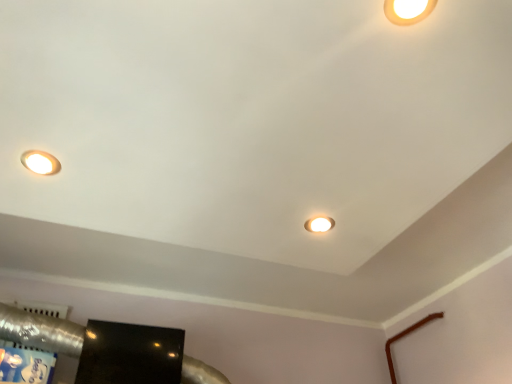
At what (x,y) coordinates should I click in order to perform the action: click on matte white lamp at upper right, which appears as the third lamp when viewed from the back. Please return your answer as a coordinate pair (x, y). The image size is (512, 384). Looking at the image, I should click on (408, 10).

Measure the distance between point (408, 2) and camera.

The distance of point (408, 2) from camera is 27.76 inches.

Where is `matte white lamp at center, which ranks as the second lamp in right-to-left order`? This screenshot has height=384, width=512. matte white lamp at center, which ranks as the second lamp in right-to-left order is located at coordinates (319, 224).

What is the approximate width of glossy black tv at lower left?

It is 15.60 centimeters.

The height and width of the screenshot is (384, 512). In order to click on glossy black tv at lower left in this screenshot , I will do `click(130, 354)`.

The height and width of the screenshot is (384, 512). What are the coordinates of `matte white lamp at upper right, which ranks as the 1th lamp in right-to-left order` in the screenshot? It's located at (408, 10).

Considering the relative sizes of matte white lamp at upper right, arranged as the 1th lamp when viewed from the front, and matte white lamp at upper left, which appears as the third lamp when viewed from the right, in the image provided, is matte white lamp at upper right, arranged as the 1th lamp when viewed from the front, smaller than matte white lamp at upper left, which appears as the third lamp when viewed from the right,?

No.

How many degrees apart are the facing directions of matte white lamp at upper right, which is counted as the 3th lamp, starting from the left, and matte white lamp at upper left, marked as the 2th lamp in a back-to-front arrangement?

The angular difference between matte white lamp at upper right, which is counted as the 3th lamp, starting from the left, and matte white lamp at upper left, marked as the 2th lamp in a back-to-front arrangement, is 180 degrees.

You are a GUI agent. You are given a task and a screenshot of the screen. Output one action in this format:
    pyautogui.click(x=<x>, y=<y>)
    Task: Click on the lamp in front of the matte white lamp at upper left, the first lamp from the left
    The image size is (512, 384).
    Given the screenshot: What is the action you would take?
    (408, 10)

Is matte white lamp at upper left, marked as the 2th lamp in a back-to-front arrangement, located within matte white lamp at upper right, the third lamp when ordered from bottom to top?

No, matte white lamp at upper left, marked as the 2th lamp in a back-to-front arrangement, is not a part of matte white lamp at upper right, the third lamp when ordered from bottom to top.

Considering the positions of point (388, 9) and point (305, 222), is point (388, 9) closer or farther from the camera than point (305, 222)?

Clearly, point (388, 9) is closer to the camera than point (305, 222).

Considering the relative positions of matte white lamp at upper right, the third lamp when ordered from bottom to top, and matte white lamp at center, marked as the first lamp in a back-to-front arrangement, in the image provided, is matte white lamp at upper right, the third lamp when ordered from bottom to top, behind matte white lamp at center, marked as the first lamp in a back-to-front arrangement,?

No, matte white lamp at upper right, the third lamp when ordered from bottom to top, is closer to the viewer.

From the image's perspective, is matte white lamp at upper right, which ranks as the 1th lamp in right-to-left order, located above or below matte white lamp at center, which appears as the first lamp when ordered from the bottom?

From the image's perspective, matte white lamp at upper right, which ranks as the 1th lamp in right-to-left order, appears above matte white lamp at center, which appears as the first lamp when ordered from the bottom.

Is matte white lamp at upper right, which is counted as the 3th lamp, starting from the left, positioned beyond the bounds of matte white lamp at center, which is counted as the third lamp, starting from the top?

Yes, matte white lamp at upper right, which is counted as the 3th lamp, starting from the left, is located beyond the bounds of matte white lamp at center, which is counted as the third lamp, starting from the top.

Looking at this image, is matte white lamp at upper left, placed as the second lamp when sorted from front to back, completely or partially outside of matte white lamp at upper right, which appears as the 1th lamp when viewed from the top?

Yes, matte white lamp at upper left, placed as the second lamp when sorted from front to back, is outside of matte white lamp at upper right, which appears as the 1th lamp when viewed from the top.

Would you consider matte white lamp at upper left, placed as the second lamp when sorted from front to back, to be distant from matte white lamp at upper right, arranged as the 1th lamp when viewed from the front?

No, matte white lamp at upper left, placed as the second lamp when sorted from front to back, is not far from matte white lamp at upper right, arranged as the 1th lamp when viewed from the front.

Is matte white lamp at upper left, which appears as the 2th lamp when ordered from the bottom, smaller than matte white lamp at upper right, the third lamp when ordered from bottom to top?

Yes, matte white lamp at upper left, which appears as the 2th lamp when ordered from the bottom, is smaller than matte white lamp at upper right, the third lamp when ordered from bottom to top.

Could matte white lamp at upper left, placed as the second lamp when sorted from front to back, be considered to be inside matte white lamp at center, which appears as the first lamp when ordered from the bottom?

No, matte white lamp at center, which appears as the first lamp when ordered from the bottom, does not contain matte white lamp at upper left, placed as the second lamp when sorted from front to back.

How different are the orientations of matte white lamp at center, which ranks as the second lamp in right-to-left order, and matte white lamp at upper left, which is counted as the 2th lamp, starting from the top, in degrees?

The angle between the facing direction of matte white lamp at center, which ranks as the second lamp in right-to-left order, and the facing direction of matte white lamp at upper left, which is counted as the 2th lamp, starting from the top, is 180 degrees.

Is matte white lamp at center, which appears as the first lamp when ordered from the bottom, oriented away from matte white lamp at upper left, which appears as the third lamp when viewed from the right?

No, matte white lamp at upper left, which appears as the third lamp when viewed from the right, is not at the back of matte white lamp at center, which appears as the first lamp when ordered from the bottom.

Considering their positions, is matte white lamp at center, which ranks as the second lamp in right-to-left order, located in front of or behind matte white lamp at upper left, which appears as the third lamp when viewed from the right?

Clearly, matte white lamp at center, which ranks as the second lamp in right-to-left order, is behind matte white lamp at upper left, which appears as the third lamp when viewed from the right.

Considering the relative positions of matte white lamp at upper right, which ranks as the 1th lamp in right-to-left order, and glossy black tv at lower left in the image provided, is matte white lamp at upper right, which ranks as the 1th lamp in right-to-left order, to the right of glossy black tv at lower left from the viewer's perspective?

Yes, matte white lamp at upper right, which ranks as the 1th lamp in right-to-left order, is to the right of glossy black tv at lower left.

Which of these two, matte white lamp at upper right, arranged as the 1th lamp when viewed from the front, or glossy black tv at lower left, is thinner?

Answer: With smaller width is matte white lamp at upper right, arranged as the 1th lamp when viewed from the front.

Is point (413, 13) more distant than point (130, 356)?

No.

Considering the relative sizes of matte white lamp at upper right, which is counted as the 3th lamp, starting from the left, and glossy black tv at lower left in the image provided, is matte white lamp at upper right, which is counted as the 3th lamp, starting from the left, shorter than glossy black tv at lower left?

Yes.

Is glossy black tv at lower left wider than matte white lamp at upper left, the first lamp from the left?

Indeed, glossy black tv at lower left has a greater width compared to matte white lamp at upper left, the first lamp from the left.

Locate an element on the screen. wide below the matte white lamp at upper left, placed as the second lamp when sorted from front to back (from the image's perspective) is located at coordinates (130, 354).

Considering the sizes of objects glossy black tv at lower left and matte white lamp at upper left, which appears as the 2th lamp when ordered from the bottom, in the image provided, who is bigger, glossy black tv at lower left or matte white lamp at upper left, which appears as the 2th lamp when ordered from the bottom,?

glossy black tv at lower left.

Is matte white lamp at upper left, which is counted as the 2th lamp, starting from the top, far from matte white lamp at center, which is counted as the third lamp, starting from the top?

Actually, matte white lamp at upper left, which is counted as the 2th lamp, starting from the top, and matte white lamp at center, which is counted as the third lamp, starting from the top, are a little close together.

From a real-world perspective, between matte white lamp at upper left, which appears as the third lamp when viewed from the right, and matte white lamp at center, which is counted as the third lamp, starting from the top, who is vertically lower?

matte white lamp at upper left, which appears as the third lamp when viewed from the right.

Considering the points (23, 155) and (318, 219), which point is in front, point (23, 155) or point (318, 219)?

The point (23, 155) is in front.

Is matte white lamp at upper left, which appears as the third lamp when viewed from the right, outside of matte white lamp at center, which is counted as the third lamp, starting from the top?

matte white lamp at upper left, which appears as the third lamp when viewed from the right, is positioned outside matte white lamp at center, which is counted as the third lamp, starting from the top.

Starting from the matte white lamp at upper right, which appears as the 1th lamp when viewed from the top, which lamp is the 2nd one to the left? Please provide its 2D coordinates.

[(40, 162)]

Which lamp is the 2nd one when counting from the front of the matte white lamp at center, which is counted as the third lamp, starting from the top? Please provide its 2D coordinates.

[(408, 10)]

From the image, which object appears to be farther from glossy black tv at lower left, matte white lamp at center, acting as the 2th lamp starting from the left, or matte white lamp at upper right, the third lamp when ordered from bottom to top?

Based on the image, matte white lamp at upper right, the third lamp when ordered from bottom to top, appears to be further to glossy black tv at lower left.

Which object lies further to the anchor point matte white lamp at upper left, the first lamp from the left, matte white lamp at center, which is the third lamp in front-to-back order, or matte white lamp at upper right, which ranks as the 1th lamp in right-to-left order?

Result: Based on the image, matte white lamp at upper right, which ranks as the 1th lamp in right-to-left order, appears to be further to matte white lamp at upper left, the first lamp from the left.

Considering their positions, is glossy black tv at lower left positioned closer to matte white lamp at upper left, which appears as the 2th lamp when ordered from the bottom, than matte white lamp at center, which appears as the first lamp when ordered from the bottom?

matte white lamp at center, which appears as the first lamp when ordered from the bottom, lies closer to matte white lamp at upper left, which appears as the 2th lamp when ordered from the bottom, than the other object.

From the image, which object appears to be nearer to matte white lamp at center, which is the third lamp in front-to-back order, matte white lamp at upper left, which is counted as the 2th lamp, starting from the top, or glossy black tv at lower left?

The object closer to matte white lamp at center, which is the third lamp in front-to-back order, is matte white lamp at upper left, which is counted as the 2th lamp, starting from the top.

Based on their spatial positions, is glossy black tv at lower left or matte white lamp at center, which is the third lamp in front-to-back order, further from matte white lamp at upper right, arranged as the 1th lamp when viewed from the front?

Based on the image, glossy black tv at lower left appears to be further to matte white lamp at upper right, arranged as the 1th lamp when viewed from the front.

When comparing their distances from matte white lamp at center, which appears as the first lamp when ordered from the bottom, does glossy black tv at lower left or matte white lamp at upper left, marked as the 2th lamp in a back-to-front arrangement, seem closer?

matte white lamp at upper left, marked as the 2th lamp in a back-to-front arrangement, lies closer to matte white lamp at center, which appears as the first lamp when ordered from the bottom, than the other object.

Looking at the image, which one is located further to matte white lamp at center, acting as the 2th lamp starting from the left, matte white lamp at upper right, which ranks as the 1th lamp in right-to-left order, or glossy black tv at lower left?

The object further to matte white lamp at center, acting as the 2th lamp starting from the left, is glossy black tv at lower left.

When comparing their distances from matte white lamp at center, which ranks as the second lamp in right-to-left order, does glossy black tv at lower left or matte white lamp at upper right, which is counted as the 3th lamp, starting from the left, seem closer?

matte white lamp at upper right, which is counted as the 3th lamp, starting from the left, is positioned closer to the anchor matte white lamp at center, which ranks as the second lamp in right-to-left order.

Locate an element on the screen. Image resolution: width=512 pixels, height=384 pixels. lamp between matte white lamp at upper left, which appears as the third lamp when viewed from the right, and matte white lamp at upper right, which is counted as the 3th lamp, starting from the left is located at coordinates pyautogui.click(x=319, y=224).

Identify the location of wide situated between matte white lamp at upper left, which appears as the third lamp when viewed from the right, and matte white lamp at center, which is counted as the third lamp, starting from the top, from left to right. (130, 354).